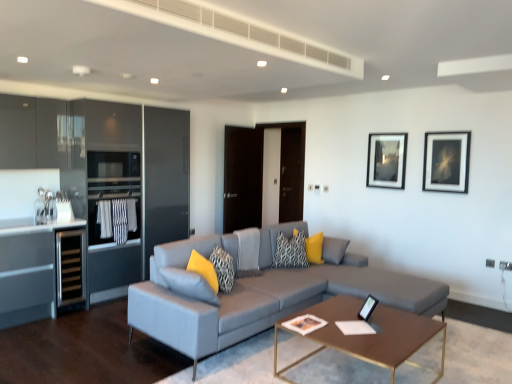
Question: From the image's perspective, relative to black stainless steel wine cooler at left, is matte black picture frame at upper right, which ranks as the second picture frame in left-to-right order, above or below?

Choices:
 (A) above
 (B) below

Answer: (A)

Question: In terms of height, does matte black picture frame at upper right, positioned as the first picture frame in front-to-back order, look taller or shorter compared to black stainless steel wine cooler at left?

Choices:
 (A) short
 (B) tall

Answer: (A)

Question: Estimate the real-world distances between objects in this image. Which object is farther from the brown metallic coffee table at center?

Choices:
 (A) yellow fabric pillow at center, the fourth pillow positioned from the front
 (B) textured gray couch at center
 (C) matte black picture frame at upper center, the 2th picture frame from the right
 (D) textured gray pillow at center, arranged as the third pillow when viewed from the right
 (E) patterned fabric pillow at center, placed as the third pillow when sorted from left to right

Answer: (C)

Question: Considering the real-world distances, which object is closest to the black stainless steel wine cooler at left?

Choices:
 (A) textured gray pillow at center, which ranks as the 3th pillow in back-to-front order
 (B) yellow fabric pillow at center, which is counted as the first pillow, starting from the back
 (C) yellow fabric pillow at lower center, acting as the fourth pillow starting from the right
 (D) matte black picture frame at upper right, marked as the 2th picture frame in a back-to-front arrangement
 (E) patterned fabric pillow at center, positioned as the second pillow in back-to-front order

Answer: (C)